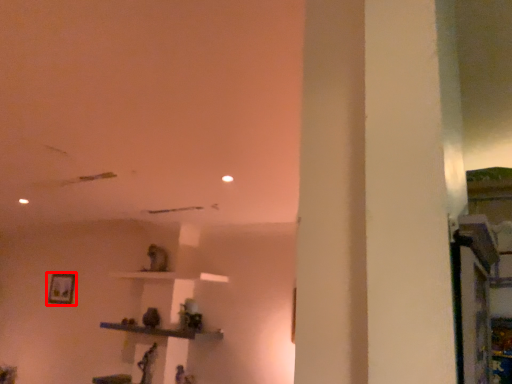
Question: From the image's perspective, what is the correct spatial relationship of picture frame (annotated by the red box) in relation to furniture?

Choices:
 (A) below
 (B) above

Answer: (B)